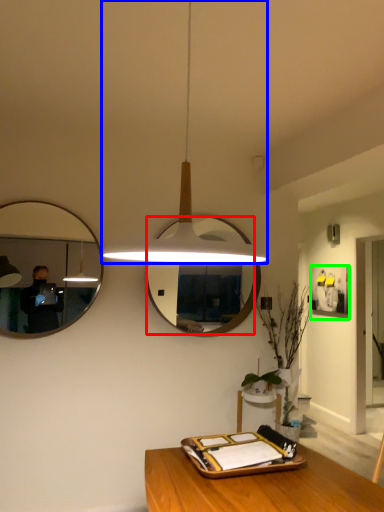
Question: Estimate the real-world distances between objects in this image. Which object is closer to mirror (highlighted by a red box), lamp (highlighted by a blue box) or picture frame (highlighted by a green box)?

Choices:
 (A) lamp
 (B) picture frame

Answer: (A)